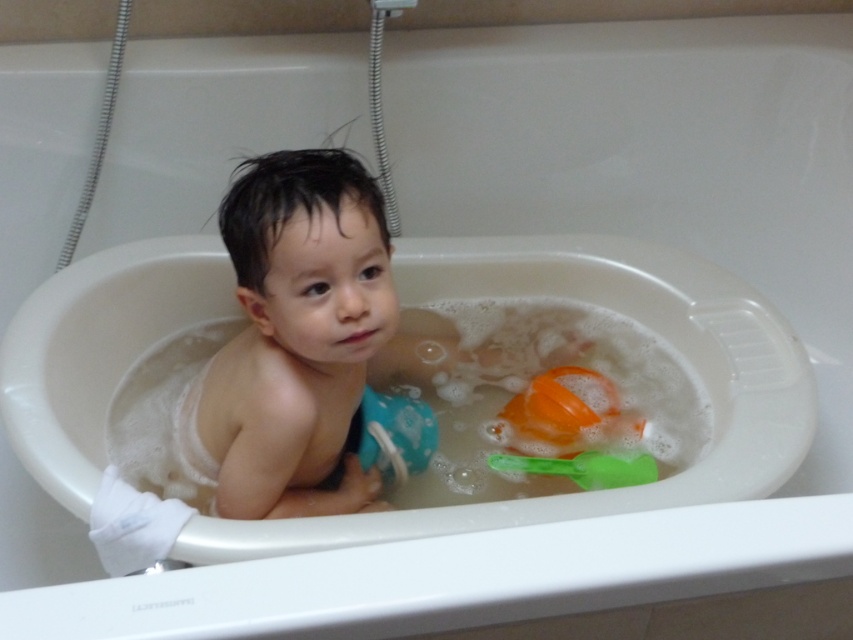
Between smooth skin baby at center and green plastic spoon at lower right, which one is positioned higher?

smooth skin baby at center is higher up.

Can you confirm if smooth skin baby at center is positioned below green plastic spoon at lower right?

No, smooth skin baby at center is not below green plastic spoon at lower right.

Is point (268, 282) farther from camera compared to point (491, 460)?

No, (268, 282) is in front of (491, 460).

The width and height of the screenshot is (853, 640). I want to click on smooth skin baby at center, so click(294, 339).